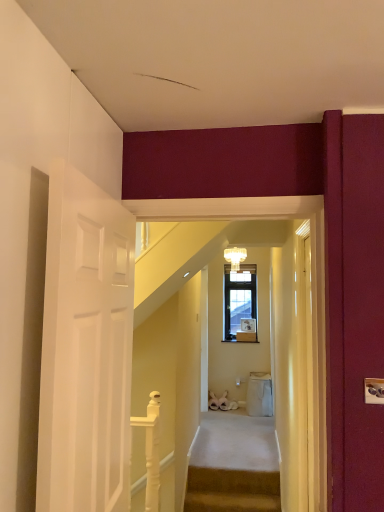
Locate an element on the screen. The image size is (384, 512). free point above white carpeted stairs at center, the first stairs when ordered from back to front (from a real-world perspective) is located at coordinates (232, 443).